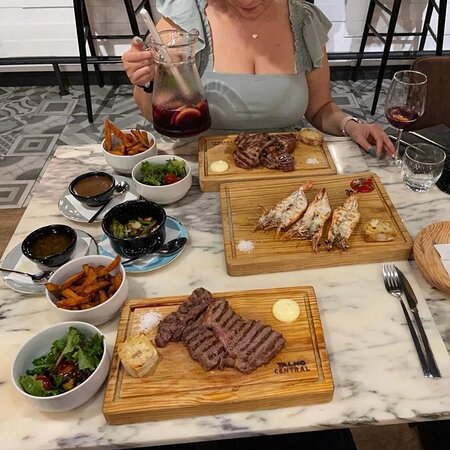
The image size is (450, 450). In order to click on bowls in this screenshot , I will do `click(96, 368)`, `click(108, 304)`, `click(138, 244)`, `click(175, 186)`, `click(96, 193)`, `click(57, 255)`, `click(129, 160)`.